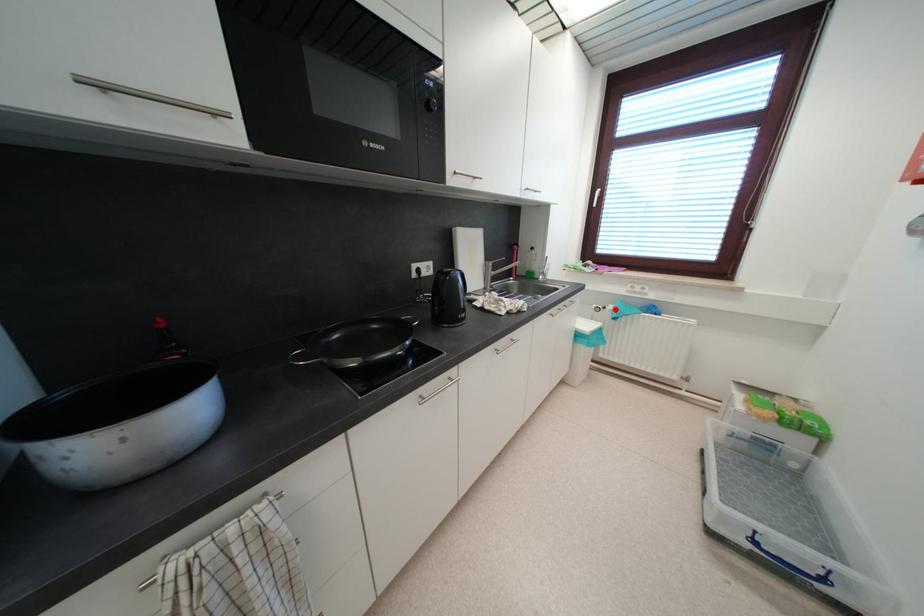
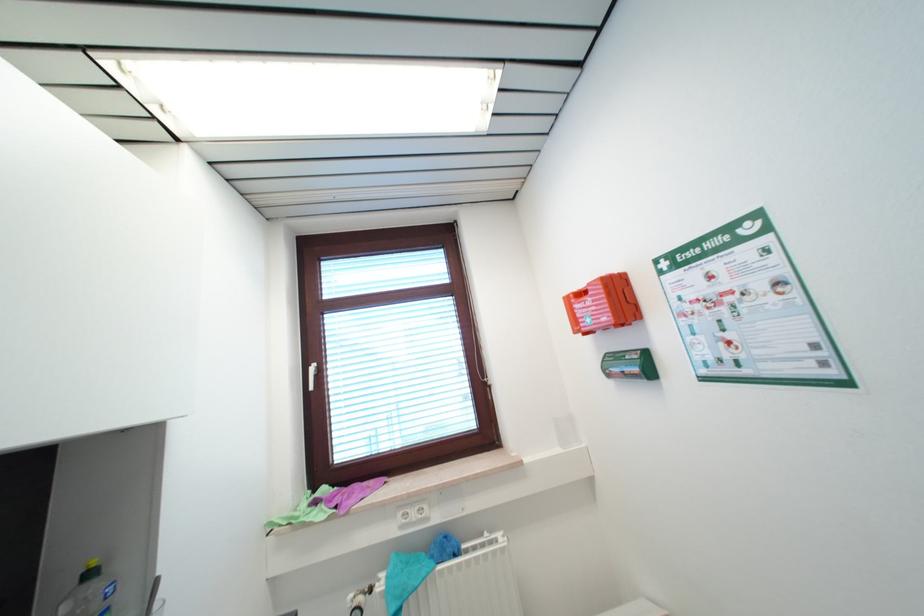
The point at the highlighted location is marked in the first image. Where is the corresponding point in the second image?

(385, 589)